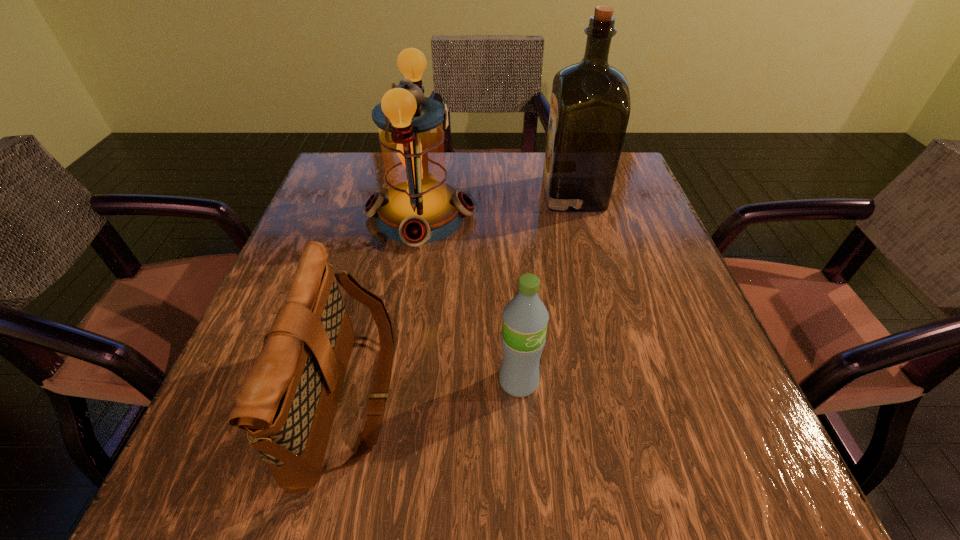
Where is `blank space at the far edge`? This screenshot has height=540, width=960. blank space at the far edge is located at coordinates (526, 175).

Where is `free spot at the near edge of the desktop`? The image size is (960, 540). free spot at the near edge of the desktop is located at coordinates pos(430,467).

Where is `vacant space at the left edge of the desktop`? The width and height of the screenshot is (960, 540). vacant space at the left edge of the desktop is located at coordinates (326, 244).

You are a GUI agent. You are given a task and a screenshot of the screen. Output one action in this format:
    pyautogui.click(x=<x>, y=<y>)
    Task: Click on the blank space at the right edge
    
    Given the screenshot: What is the action you would take?
    pyautogui.click(x=648, y=405)

In the image, there is a desktop. What are the coordinates of `free space at the far left corner` in the screenshot? It's located at (360, 196).

In the image, there is a desktop. Where is `free region at the near left corner`? The image size is (960, 540). free region at the near left corner is located at coordinates (215, 485).

Image resolution: width=960 pixels, height=540 pixels. What are the coordinates of `vacant space at the far right corner` in the screenshot? It's located at (645, 199).

Locate an element on the screen. Image resolution: width=960 pixels, height=540 pixels. free space at the near right corner of the desktop is located at coordinates (766, 448).

I want to click on free space that is in between the second object from right to left and the lantern, so click(x=469, y=299).

Locate an element on the screen. This screenshot has width=960, height=540. free space that is in between the rightmost object and the lantern is located at coordinates (496, 205).